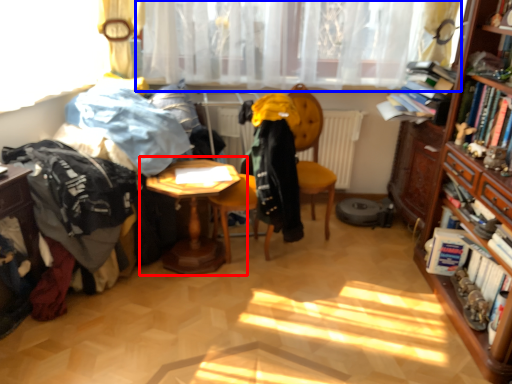
Question: Which point is closer to the camera, table (highlighted by a red box) or curtain (highlighted by a blue box)?

Choices:
 (A) table
 (B) curtain

Answer: (A)